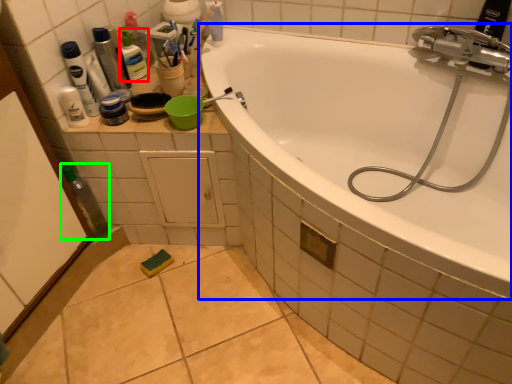
Question: Considering the real-world distances, which object is closest to toiletry (highlighted by a red box)? bathtub (highlighted by a blue box) or bottle (highlighted by a green box).

Choices:
 (A) bathtub
 (B) bottle

Answer: (B)